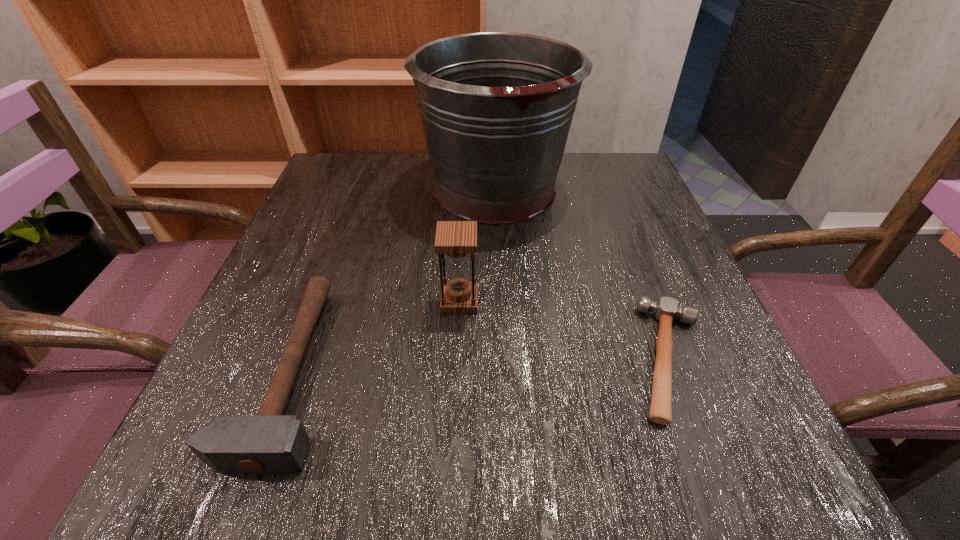
The image size is (960, 540). Find the location of `the farthest object`. the farthest object is located at coordinates (496, 107).

At what (x,y) coordinates should I click in order to perform the action: click on the tallest object. Please return your answer as a coordinate pair (x, y). Looking at the image, I should click on (496, 107).

Where is `hourglass`? This screenshot has width=960, height=540. hourglass is located at coordinates (456, 239).

Where is `the left hammer`? the left hammer is located at coordinates (268, 443).

You are a GUI agent. You are given a task and a screenshot of the screen. Output one action in this format:
    pyautogui.click(x=<x>, y=<y>)
    Task: Click on the taller hammer
    
    Given the screenshot: What is the action you would take?
    pyautogui.click(x=268, y=443)

Find the location of a particular element. Image resolution: width=960 pixels, height=540 pixels. the shortest object is located at coordinates (666, 309).

Locate an element on the screen. The image size is (960, 540). the shorter hammer is located at coordinates (666, 309).

Identify the location of blank space located on the right of the farthest object. (592, 189).

Locate an element on the screen. vacant region located on the back of the third shortest object is located at coordinates (463, 231).

Identify the location of vacant space located 0.240m on the striking surface of the left hammer. (491, 370).